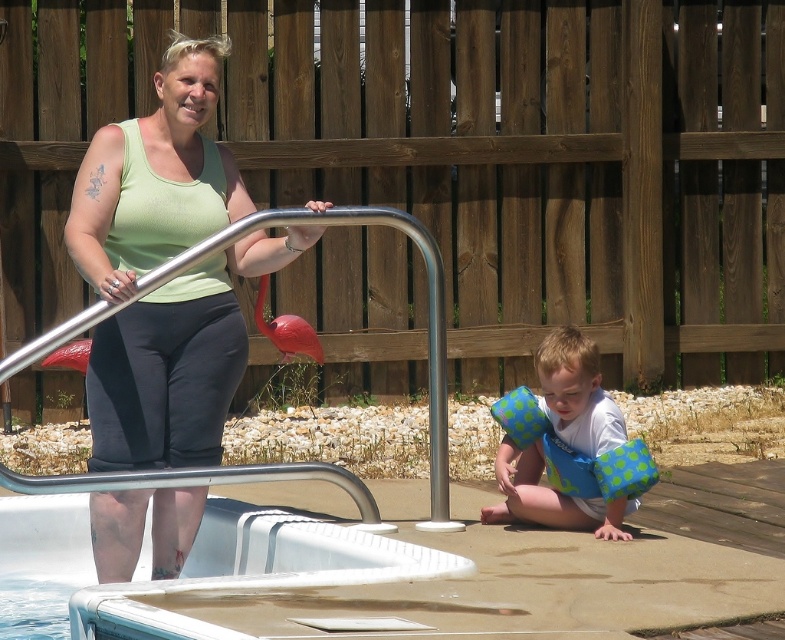
From the picture: Is silver metallic handrail at upper center closer to the viewer compared to white fabric shirt at lower right?

That is True.

Is point (152, 477) in front of point (517, 474)?

Yes, it is.

I want to click on silver metallic handrail at upper center, so click(x=426, y=321).

Does green matte tank top at upper left have a greater width compared to white fabric shirt at lower right?

Indeed, green matte tank top at upper left has a greater width compared to white fabric shirt at lower right.

The image size is (785, 640). Identify the location of green matte tank top at upper left. (177, 362).

Who is more distant from viewer, (353, 572) or (429, 269)?

Point (429, 269)

Where is `white plastic pool at lower left`? The image size is (785, 640). white plastic pool at lower left is located at coordinates (184, 563).

Where is `white plastic pool at lower left`? white plastic pool at lower left is located at coordinates (184, 563).